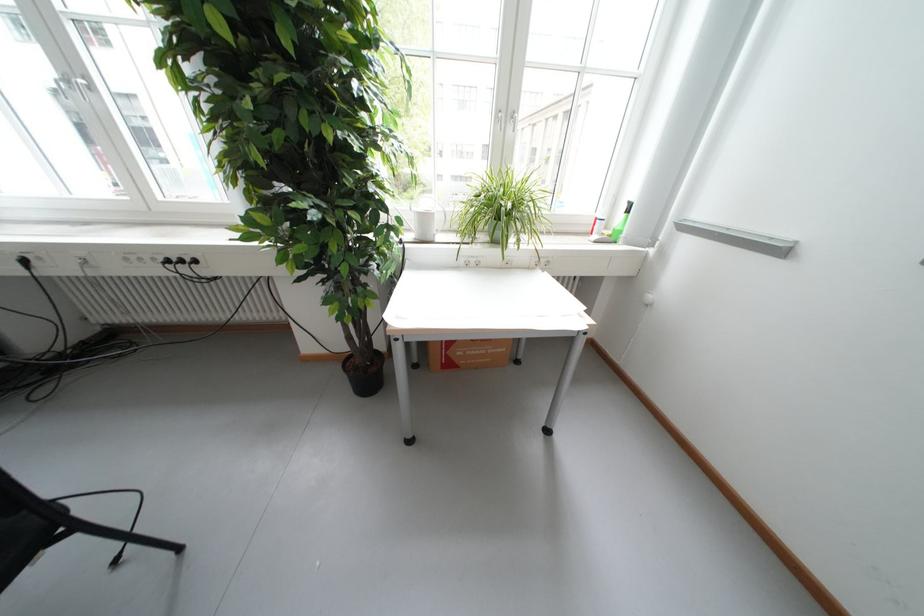
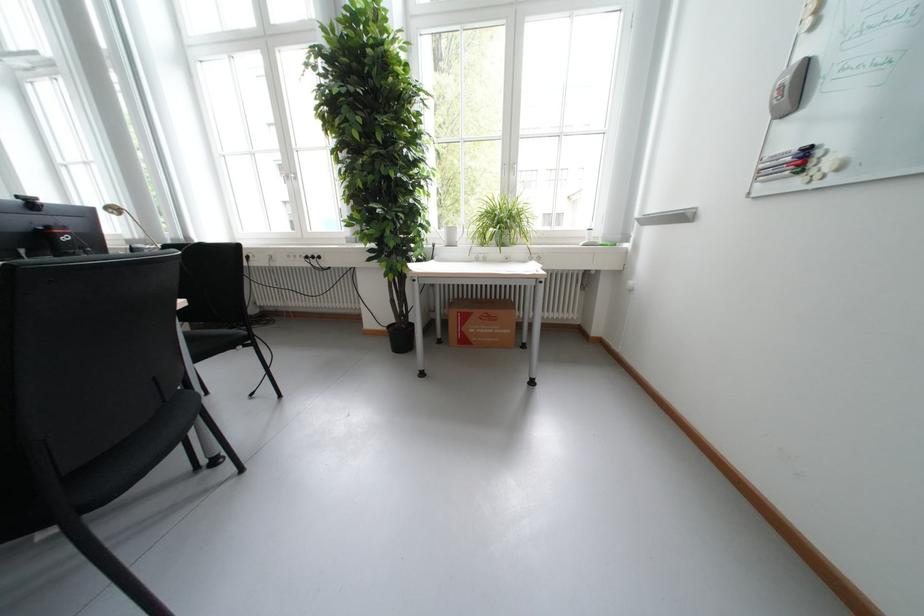
Where in the second image is the point corresponding to (x=191, y=262) from the first image?

(322, 257)